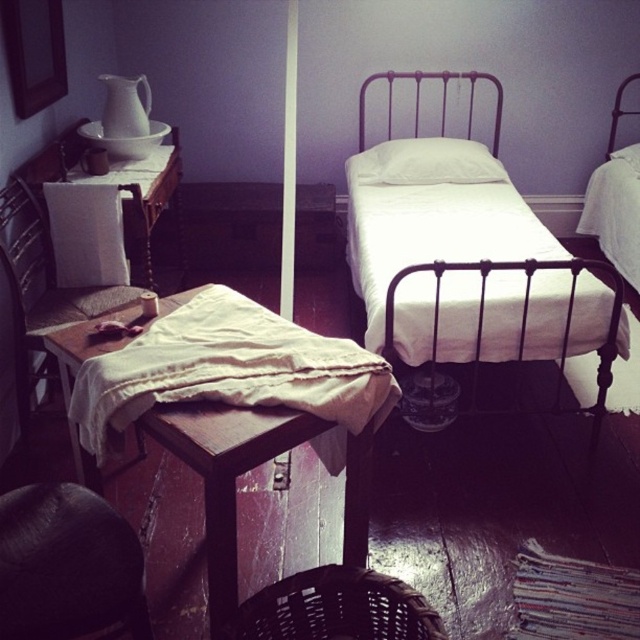
You are trying to place a rectangular box that is 1.2 meters wide on the wooden table at center. The white cotton pillow at center is currently on the table. Can the box fit on the table without overlapping the pillow?

The wooden table at center might be wider than white cotton pillow at center, but since the exact dimensions of the table are unknown, it is uncertain whether the box will fit without overlapping the pillow.

You are standing in the middle of the room and want to place a 3.5 feet long decorative rod horizontally between the wooden table at center and the white soft pillow at center. Will the rod fit without bending or breaking?

The distance between the wooden table at center and the white soft pillow at center is 6.73 feet, which is longer than the rod of 3.5 feet. Therefore, the rod will fit without bending or breaking.